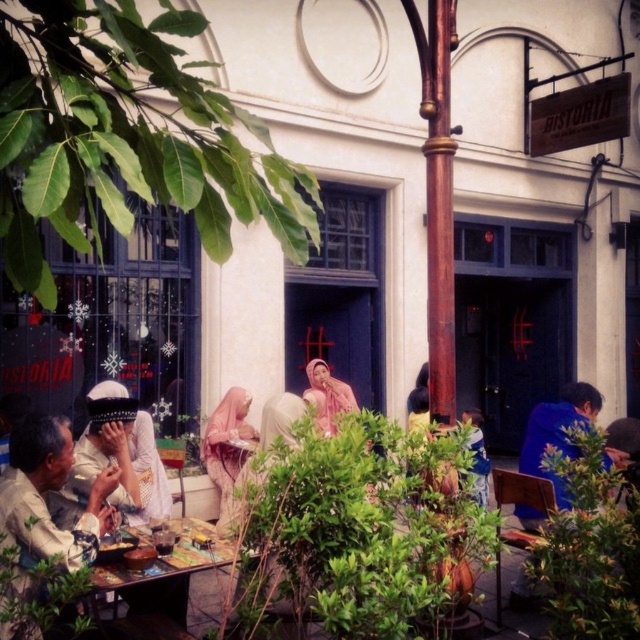
Which of these two, white fabric headscarf at lower left or white matte headscarf at left, stands shorter?

Standing shorter between the two is white fabric headscarf at lower left.

Who is more distant from viewer, [40,444] or [144,502]?

The point [144,502] is more distant.

The height and width of the screenshot is (640, 640). I want to click on white fabric headscarf at lower left, so click(x=48, y=492).

Where is `white fabric headscarf at lower left`? The image size is (640, 640). white fabric headscarf at lower left is located at coordinates [x=48, y=492].

Who is more distant from viewer, (88, 436) or (324, 412)?

The point (324, 412) is more distant.

In the scene shown: Who is more forward, (129,426) or (321,362)?

Point (129,426) is in front.

Between point (131, 480) and point (320, 426), which one is positioned in front?

Point (131, 480) is in front.

At what (x,y) coordinates should I click in order to perform the action: click on white matte headscarf at left. Please return your answer as a coordinate pair (x, y). Looking at the image, I should click on (124, 467).

Can you confirm if blue fabric shirt at right is positioned to the left of pink fabric headscarf at center?

No, blue fabric shirt at right is not to the left of pink fabric headscarf at center.

Which is more to the left, blue fabric shirt at right or pink fabric headscarf at center?

pink fabric headscarf at center

Is point (588, 410) closer to viewer compared to point (333, 432)?

Yes, point (588, 410) is closer to viewer.

The image size is (640, 640). I want to click on blue fabric shirt at right, so click(557, 433).